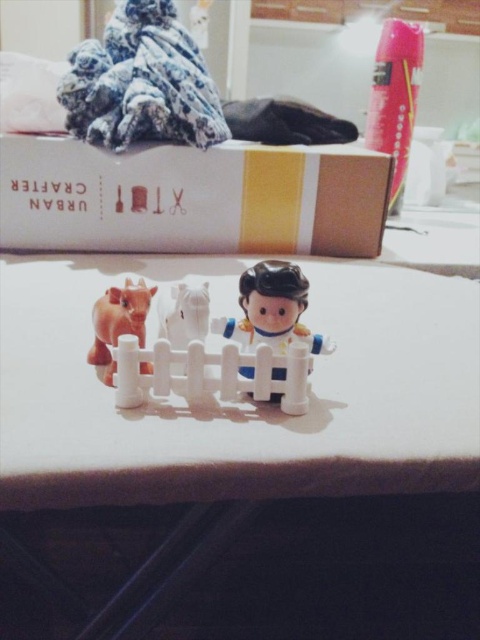
You are setting up a miniature farm scene on a table. You have a white plastic table at center and a white plastic fence at center. You want to place a new toy animal between them. What is the minimum distance the toy animal should be placed from each object to ensure it fits between them?

The white plastic table at center and white plastic fence at center are 8.14 inches apart. To fit between them, the toy animal should be placed at least 0.01 inches away from each object, totaling 8.12 inches between the objects themselves.

You are a toy collector trying to fit the fluffy fabric at upper left and the smooth plastic figure at center into a display case that is 15 cm tall. Based on their heights, can both items fit vertically without bending or damaging them?

The fluffy fabric at upper left is much taller than the smooth plastic figure at center. Since the display case is only 15 cm tall, and the fluffy fabric is taller than the figure, it might not fit unless the fabric is compressed, which could damage it. The smooth plastic figure at center might fit, but the fluffy fabric at upper left may exceed the height limit.